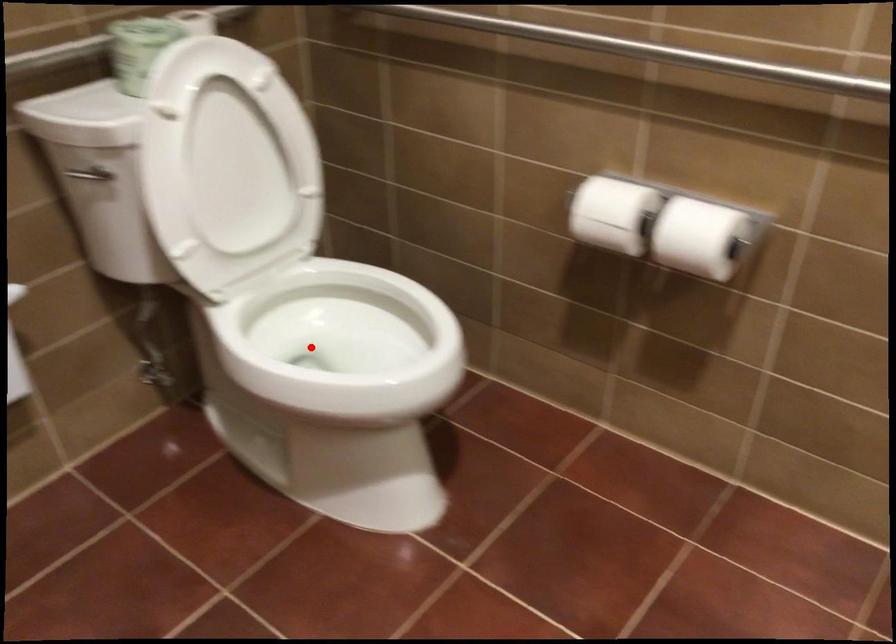
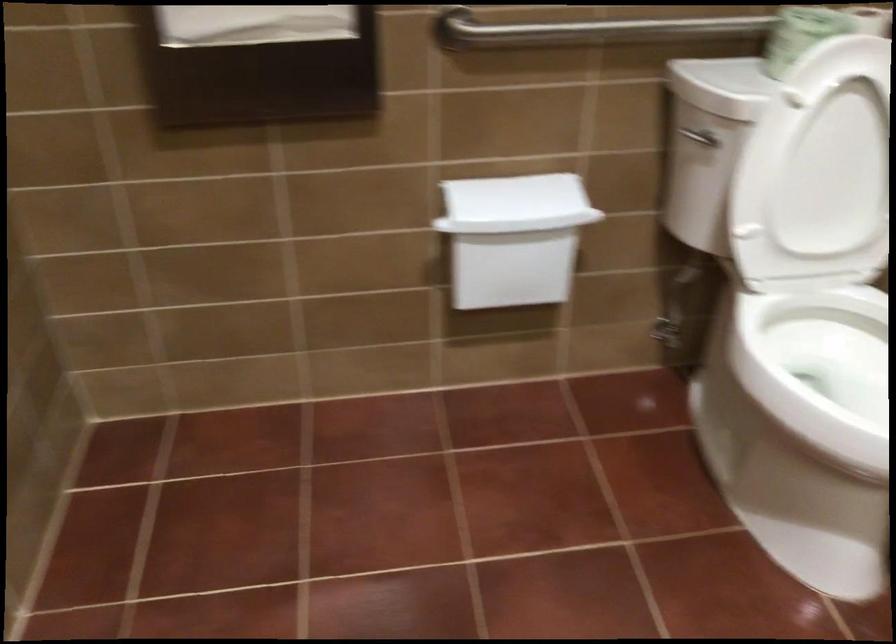
Locate, in the second image, the point that corresponds to the highlighted location in the first image.

(819, 368)